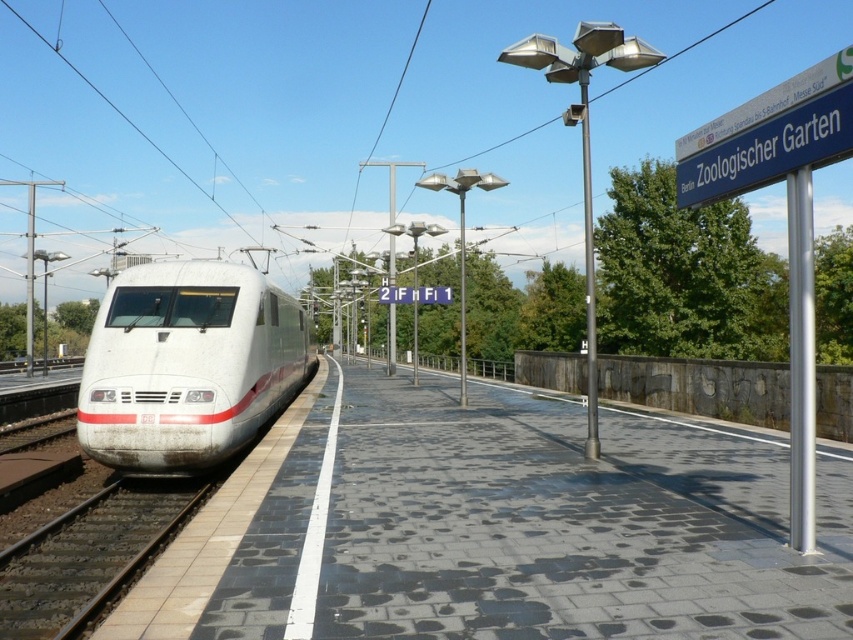
You are standing on the train station platform and want to reach a specific point marked at coordinates point (520, 616). If you walk straight ahead, will you reach that point before the white safety line? The safety line is 5 meters away from where you are standing.

The point (520, 616) is 4.75 meters from viewer, which is closer than the safety line at 5 meters. Therefore, you will reach the point before the safety line.

You are a passenger waiting on the platform and want to board the white glossy bullet train at left. Where should you stand relative to the black textured platform at center to board the train?

The black textured platform at center is located below the white glossy bullet train at left, so you should stand on the black textured platform at center directly underneath the train to board the white glossy bullet train at left.